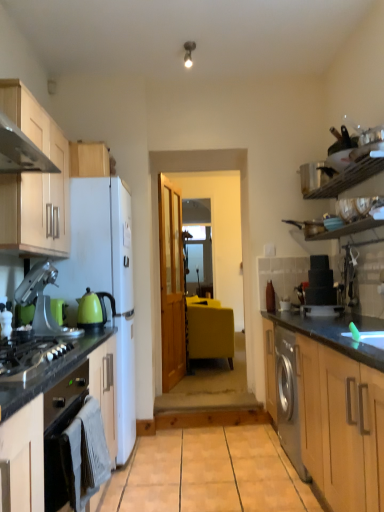
Where is `transparent glass door at center`? transparent glass door at center is located at coordinates (198, 261).

Locate an element on the screen. silver metallic stand mixer at left, the second coffee machine from the right is located at coordinates (43, 302).

I want to click on stainless steel gas stove at lower left, so click(x=29, y=357).

The width and height of the screenshot is (384, 512). In order to click on matte black oven at left, the first cabinetry ordered from the bottom in this screenshot , I will do `click(45, 391)`.

Describe the element at coordinates (321, 311) in the screenshot. This screenshot has width=384, height=512. I see `white glossy plate at right, the first appliance in the bottom-to-top sequence` at that location.

Describe the element at coordinates (315, 176) in the screenshot. The width and height of the screenshot is (384, 512). I see `metallic silver pot at upper right, which ranks as the 2th appliance in bottom-to-top order` at that location.

Locate an element on the screen. transparent glass door at center is located at coordinates (198, 261).

From the image's perspective, who appears lower, light wood cabinet at upper left, the third cabinetry in the bottom-to-top sequence, or black granite countertop at right?

black granite countertop at right.

Which is behind, point (105, 160) or point (349, 449)?

Positioned behind is point (105, 160).

Are light wood cabinet at upper left, positioned as the first cabinetry in top-to-bottom order, and black granite countertop at right far apart?

That's right, there is a large distance between light wood cabinet at upper left, positioned as the first cabinetry in top-to-bottom order, and black granite countertop at right.

Looking at this image, between silver metallic stand mixer at left, acting as the 1th coffee machine starting from the front, and white matte refrigerator at left, which one has less height?

silver metallic stand mixer at left, acting as the 1th coffee machine starting from the front.

Does silver metallic stand mixer at left, the 2th coffee machine when ordered from back to front, have a lesser width compared to white matte refrigerator at left?

Yes, silver metallic stand mixer at left, the 2th coffee machine when ordered from back to front, is thinner than white matte refrigerator at left.

From the image's perspective, is silver metallic stand mixer at left, which ranks as the first coffee machine in left-to-right order, located above white matte refrigerator at left?

Yes, from the image's perspective, silver metallic stand mixer at left, which ranks as the first coffee machine in left-to-right order, is on top of white matte refrigerator at left.

Considering the positions of objects silver metallic stand mixer at left, acting as the 1th coffee machine starting from the front, and white matte refrigerator at left in the image provided, who is more to the left, silver metallic stand mixer at left, acting as the 1th coffee machine starting from the front, or white matte refrigerator at left?

From the viewer's perspective, silver metallic stand mixer at left, acting as the 1th coffee machine starting from the front, appears more on the left side.

Where is `the 2nd appliance located above the black granite countertop at right (from a real-world perspective)`? The height and width of the screenshot is (512, 384). the 2nd appliance located above the black granite countertop at right (from a real-world perspective) is located at coordinates (315, 176).

Is black granite countertop at right placed right next to metallic silver pot at upper right, which ranks as the 2th appliance in bottom-to-top order?

No, black granite countertop at right is not making contact with metallic silver pot at upper right, which ranks as the 2th appliance in bottom-to-top order.

Consider the image. From the image's perspective, would you say black granite countertop at right is positioned over metallic silver pot at upper right, which ranks as the 2th appliance in bottom-to-top order?

No.

Is black granite countertop at right positioned with its back to metallic silver pot at upper right, which is the first appliance in top-to-bottom order?

black granite countertop at right does not have its back to metallic silver pot at upper right, which is the first appliance in top-to-bottom order.

Could you measure the distance between light wood cabinet at upper left, the 2th cabinetry viewed from the top, and transparent glass door at center?

light wood cabinet at upper left, the 2th cabinetry viewed from the top, is 11.99 feet from transparent glass door at center.

Looking at this image, would you say light wood cabinet at upper left, marked as the 2th cabinetry in a bottom-to-top arrangement, is inside or outside transparent glass door at center?

light wood cabinet at upper left, marked as the 2th cabinetry in a bottom-to-top arrangement, is not inside transparent glass door at center, it's outside.

Considering the positions of points (34, 185) and (204, 249), is point (34, 185) farther from camera compared to point (204, 249)?

No, (34, 185) is in front of (204, 249).

Is light wood cabinet at upper left, the 2th cabinetry viewed from the top, aimed at transparent glass door at center?

No, light wood cabinet at upper left, the 2th cabinetry viewed from the top, is not facing towards transparent glass door at center.

Considering the sizes of objects yellow fabric couch at center and white glossy plate at right, the first appliance in the bottom-to-top sequence, in the image provided, who is bigger, yellow fabric couch at center or white glossy plate at right, the first appliance in the bottom-to-top sequence,?

Bigger between the two is yellow fabric couch at center.

From a real-world perspective, is yellow fabric couch at center beneath white glossy plate at right, which is counted as the second appliance, starting from the top?

Yes, from a real-world perspective, yellow fabric couch at center is under white glossy plate at right, which is counted as the second appliance, starting from the top.

Between yellow fabric couch at center and white glossy plate at right, the first appliance in the bottom-to-top sequence, which one has less height?

With less height is white glossy plate at right, the first appliance in the bottom-to-top sequence.

Looking at this image, from the image's perspective, does yellow fabric couch at center appear lower than white glossy plate at right, which is counted as the second appliance, starting from the top?

Yes.

From the image's perspective, who appears lower, transparent glass door at center or white glossy plate at right, which is counted as the second appliance, starting from the top?

white glossy plate at right, which is counted as the second appliance, starting from the top, is shown below in the image.

In the scene shown: Is transparent glass door at center positioned in front of white glossy plate at right, which is counted as the second appliance, starting from the top?

That is False.

Is transparent glass door at center completely or partially outside of white glossy plate at right, which is counted as the second appliance, starting from the top?

Absolutely, transparent glass door at center is external to white glossy plate at right, which is counted as the second appliance, starting from the top.

Is transparent glass door at center not close to white glossy plate at right, which is counted as the second appliance, starting from the top?

transparent glass door at center is positioned a significant distance from white glossy plate at right, which is counted as the second appliance, starting from the top.

Based on the photo, would you say transparent glass door at center is outside yellow fabric couch at center?

That's correct, transparent glass door at center is outside of yellow fabric couch at center.

Considering the relative sizes of transparent glass door at center and yellow fabric couch at center in the image provided, is transparent glass door at center shorter than yellow fabric couch at center?

No.

From the image's perspective, is transparent glass door at center under yellow fabric couch at center?

Actually, transparent glass door at center appears above yellow fabric couch at center in the image.

This screenshot has height=512, width=384. I want to click on cabinetry that is the 1st one when counting leftward from the black granite countertop at right, so click(89, 160).

Where is `refrigerator behind the silver metallic stand mixer at left, the second coffee machine from the right`? The image size is (384, 512). refrigerator behind the silver metallic stand mixer at left, the second coffee machine from the right is located at coordinates (105, 279).

From the image, which object appears to be farther from black granite countertop at right, white glossy plate at right, the first appliance in the bottom-to-top sequence, or light wood cabinet at upper left, positioned as the first cabinetry in top-to-bottom order?

Among the two, light wood cabinet at upper left, positioned as the first cabinetry in top-to-bottom order, is located further to black granite countertop at right.

Considering their positions, is light wood cabinet at upper left, the third cabinetry in the bottom-to-top sequence, positioned further to stainless steel gas stove at lower left than black granite countertop at right?

light wood cabinet at upper left, the third cabinetry in the bottom-to-top sequence.

Based on their spatial positions, is light wood cabinet at upper left, the third cabinetry in the bottom-to-top sequence, or yellow fabric couch at center further from green glossy kettle at left?

yellow fabric couch at center.

Based on their spatial positions, is matte black oven at left, the first cabinetry ordered from the bottom, or light wood cabinet at upper left, marked as the 2th cabinetry in a bottom-to-top arrangement, further from transparent glass door at center?

Based on the image, matte black oven at left, the first cabinetry ordered from the bottom, appears to be further to transparent glass door at center.

When comparing their distances from green glossy kettle at left, does matte black oven at left, the third cabinetry when ordered from top to bottom, or silver metallic stand mixer at left, acting as the 1th coffee machine starting from the front, seem closer?

silver metallic stand mixer at left, acting as the 1th coffee machine starting from the front.

Which object lies further to the anchor point transparent glass door at center, metallic silver pot at upper right, which ranks as the 2th appliance in bottom-to-top order, or yellow fabric couch at center?

metallic silver pot at upper right, which ranks as the 2th appliance in bottom-to-top order, is positioned further to the anchor transparent glass door at center.

When comparing their distances from light wood cabinet at upper left, the 2th cabinetry viewed from the top, does stainless steel gas stove at lower left or white matte refrigerator at left seem further?

Based on the image, stainless steel gas stove at lower left appears to be further to light wood cabinet at upper left, the 2th cabinetry viewed from the top.

Considering their positions, is black granite countertop at right positioned further to white glossy plate at right, which is counted as the second appliance, starting from the top, than yellow fabric couch at center?

yellow fabric couch at center is positioned further to the anchor white glossy plate at right, which is counted as the second appliance, starting from the top.

The width and height of the screenshot is (384, 512). I want to click on tea pot situated between matte black oven at left, the first cabinetry ordered from the bottom, and black plastic coffee machine at right, the 1th coffee machine in the right-to-left sequence, from left to right, so click(x=93, y=309).

Locate an element on the screen. Image resolution: width=384 pixels, height=512 pixels. tea pot between light wood cabinet at upper left, positioned as the first cabinetry in top-to-bottom order, and metallic silver pot at upper right, which ranks as the 2th appliance in bottom-to-top order, from left to right is located at coordinates (93, 309).

Identify the location of cabinetry between silver metallic stand mixer at left, which ranks as the first coffee machine in left-to-right order, and yellow fabric couch at center from front to back. This screenshot has height=512, width=384. (89, 160).

What are the coordinates of `counter positioned between matte black oven at left, the first cabinetry ordered from the bottom, and transparent glass door at center from near to far` in the screenshot? It's located at (339, 411).